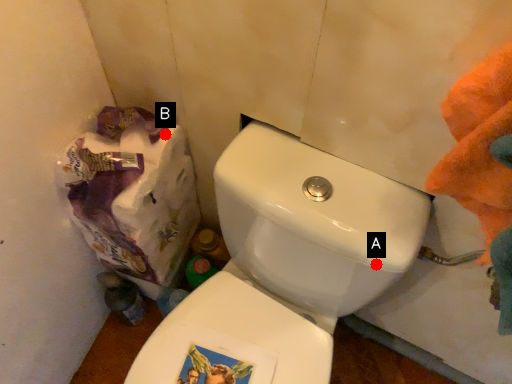
Question: Two points are circled on the image, labeled by A and B beside each circle. Which of the following is the farthest from the observer?

Choices:
 (A) A is further
 (B) B is further

Answer: (B)